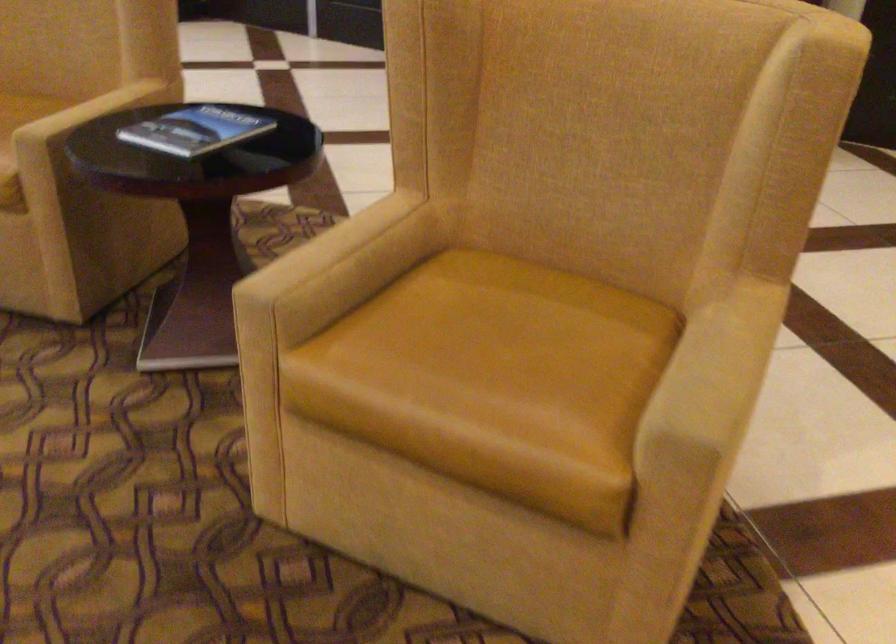
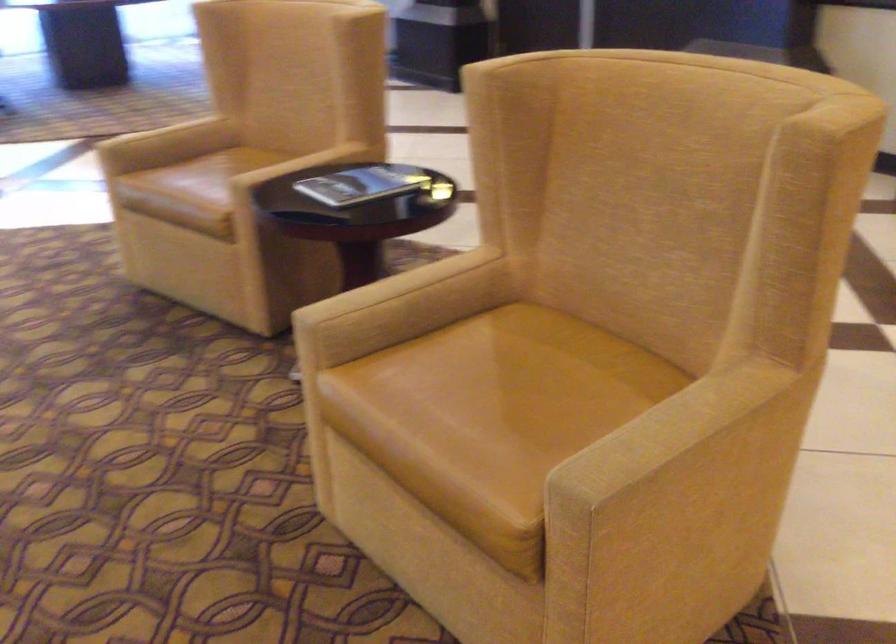
Question: What movement of the cameraman would produce the second image?

Choices:
 (A) Left
 (B) Right
 (C) Forward
 (D) Backward

Answer: (B)